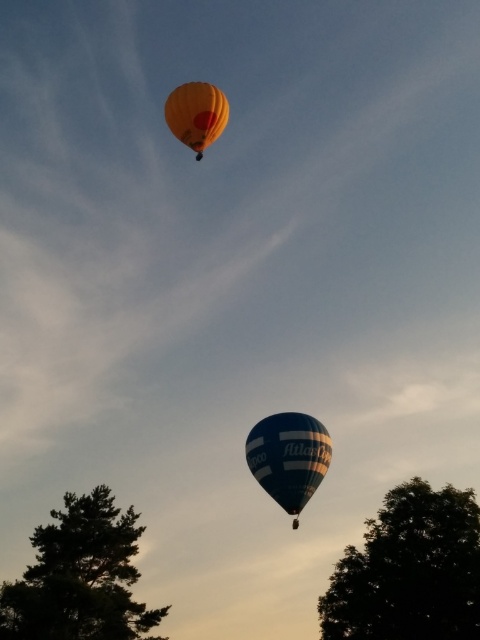
Question: Estimate the real-world distances between objects in this image. Which object is farther from the blue striped fabric hot air balloon at lower center?

Choices:
 (A) dark green leafy tree at lower right
 (B) green leafy tree at lower left
 (C) yellow fabric balloon at upper center

Answer: (C)

Question: Is green leafy tree at lower left smaller than blue striped fabric hot air balloon at lower center?

Choices:
 (A) yes
 (B) no

Answer: (B)

Question: Does dark green leafy tree at lower right have a lesser width compared to green leafy tree at lower left?

Choices:
 (A) no
 (B) yes

Answer: (B)

Question: Does dark green leafy tree at lower right have a lesser width compared to yellow fabric balloon at upper center?

Choices:
 (A) yes
 (B) no

Answer: (B)

Question: Which object appears closest to the camera in this image?

Choices:
 (A) blue striped fabric hot air balloon at lower center
 (B) dark green leafy tree at lower right
 (C) green leafy tree at lower left
 (D) yellow fabric balloon at upper center

Answer: (C)

Question: Which object is the farthest from the blue striped fabric hot air balloon at lower center?

Choices:
 (A) yellow fabric balloon at upper center
 (B) dark green leafy tree at lower right
 (C) green leafy tree at lower left

Answer: (A)